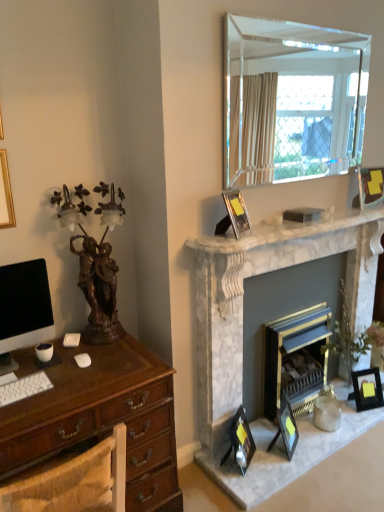
Question: Considering the positions of matte black monitor at left and clear glass mirror at upper right in the image, is matte black monitor at left taller or shorter than clear glass mirror at upper right?

Choices:
 (A) short
 (B) tall

Answer: (A)

Question: Would you say matte black monitor at left is inside or outside clear glass mirror at upper right?

Choices:
 (A) inside
 (B) outside

Answer: (B)

Question: Estimate the real-world distances between objects in this image. Which object is farther from the silver metallic picture frame at upper center, the fifth picture frame from the right?

Choices:
 (A) brown wood desk at lower left
 (B) matte black monitor at left
 (C) matte black picture frame at lower right, the second picture frame in the left-to-right sequence
 (D) clear glass mirror at upper right
 (E) matte black picture frame at right, the 4th picture frame from the left

Answer: (E)

Question: Based on their relative distances, which object is nearer to the blue painted metal fireplace at center, the 2th fireplace positioned from the left?

Choices:
 (A) matte black picture frame at lower center, which is the third picture frame in left-to-right order
 (B) white marble fireplace at upper center
 (C) matte black picture frame at lower right, placed as the first picture frame when sorted from bottom to top
 (D) matte black picture frame at upper right, the 1th picture frame in the top-to-bottom sequence
 (E) brown wood desk at lower left

Answer: (A)